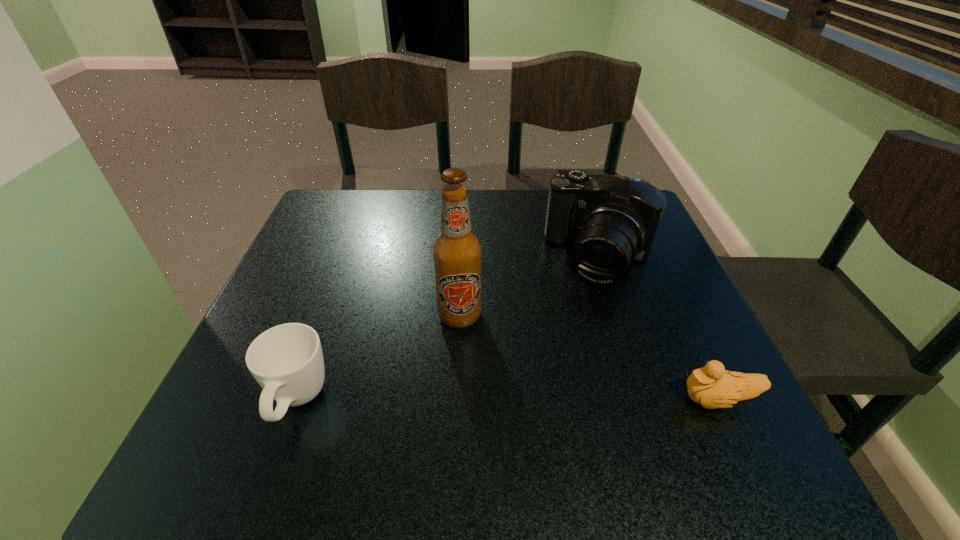
This screenshot has height=540, width=960. I want to click on free region located on the lens of the farthest object, so click(572, 318).

Locate an element on the screen. free location located 0.240m on the lens of the farthest object is located at coordinates (546, 372).

Find the location of a particular element. Image resolution: width=960 pixels, height=540 pixels. vacant space situated 0.090m on the front label of the tallest object is located at coordinates (452, 370).

Locate an element on the screen. This screenshot has width=960, height=540. vacant area situated 0.060m on the front label of the tallest object is located at coordinates (454, 357).

This screenshot has width=960, height=540. In order to click on vacant space located on the front label of the tallest object in this screenshot , I will do `click(444, 420)`.

Identify the location of object situated at the far edge. This screenshot has width=960, height=540. (613, 219).

The width and height of the screenshot is (960, 540). In order to click on cup that is positioned at the near edge in this screenshot , I will do coord(287,361).

Locate an element on the screen. Image resolution: width=960 pixels, height=540 pixels. duckling positioned at the near edge is located at coordinates (712, 386).

I want to click on object that is at the left edge, so click(287, 361).

Where is `duckling that is positioned at the right edge`? This screenshot has width=960, height=540. duckling that is positioned at the right edge is located at coordinates (712, 386).